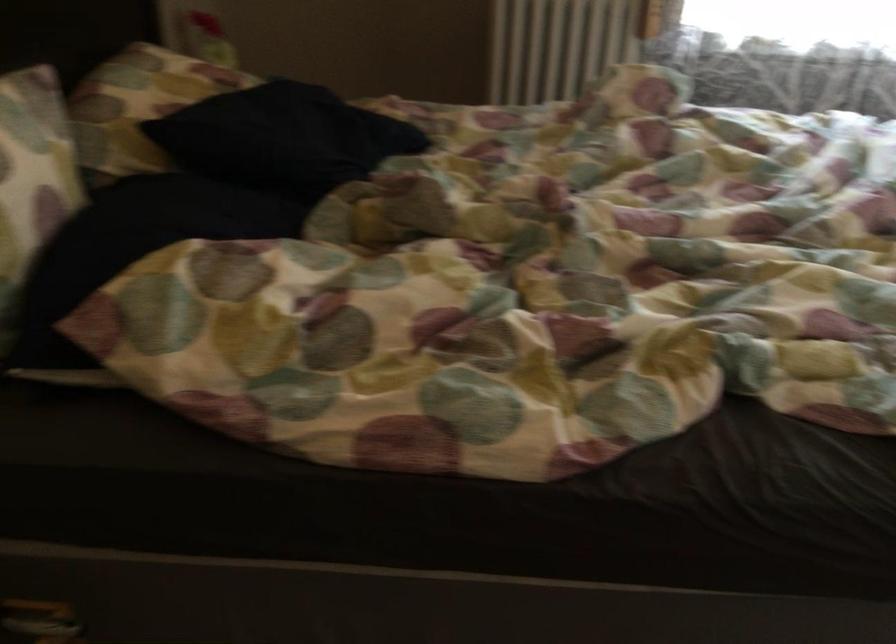
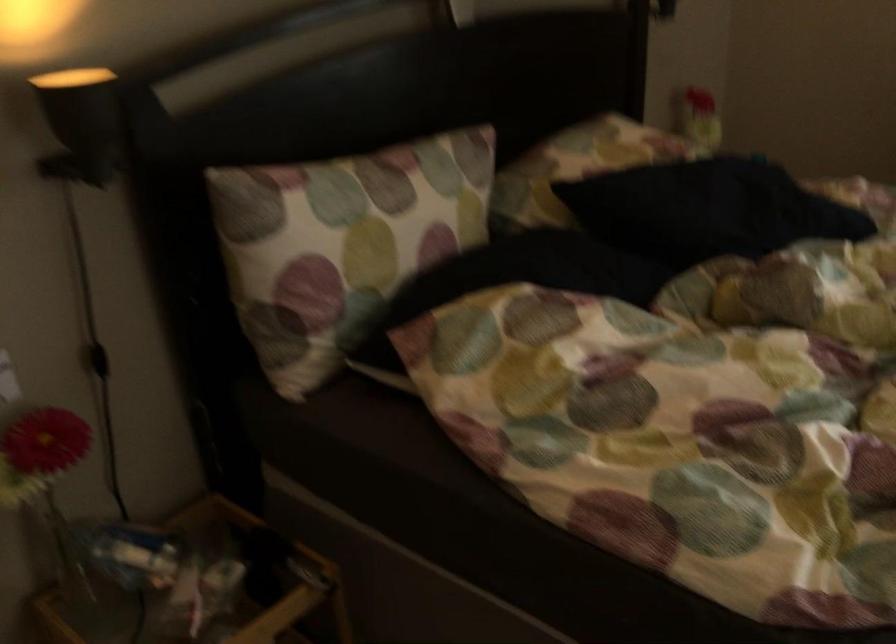
Question: The first image is from the beginning of the video and the second image is from the end. How did the camera likely rotate when shooting the video?

Choices:
 (A) Left
 (B) Right
 (C) Up
 (D) Down

Answer: (A)